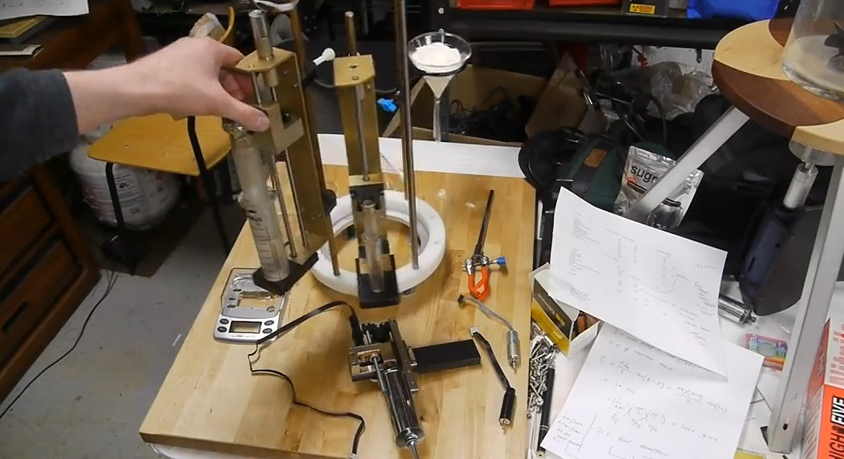
Find the location of a particular element. The width and height of the screenshot is (844, 459). paper with writing is located at coordinates (695, 400).